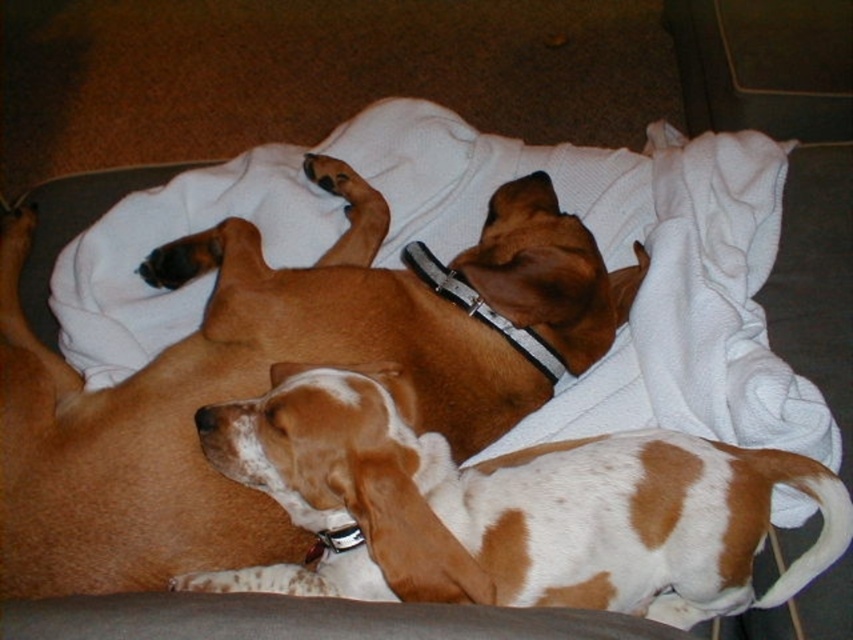
You are a photographer standing in front of a couch with a brown smooth dog at upper center. You want to take a closeup photo of the dog. If your camera requires the subject to be at least 36 inches away to focus properly, will you need to move closer or farther away?

The brown smooth dog at upper center is currently 35.55 inches away from the camera. Since the minimum focusing distance is 36 inches, you need to move farther away to achieve proper focus.

You are a photographer setting up a shoot in the living room. You need to position a light source to the right of the white and brown fur at center. Where should you place the light source relative to the brown smooth dog at upper center?

The brown smooth dog at upper center is to the left of white and brown fur at center. Therefore, placing the light source to the right of the white and brown fur at center would mean positioning it to the right side of the brown smooth dog at upper center.

You are standing in a living room with a couch and carpeted floor. You see a white towel on the couch. There is a point marked at coordinates (268, 378). What object is located at that point?

The point at coordinates (268, 378) indicates the brown smooth dog at upper center.